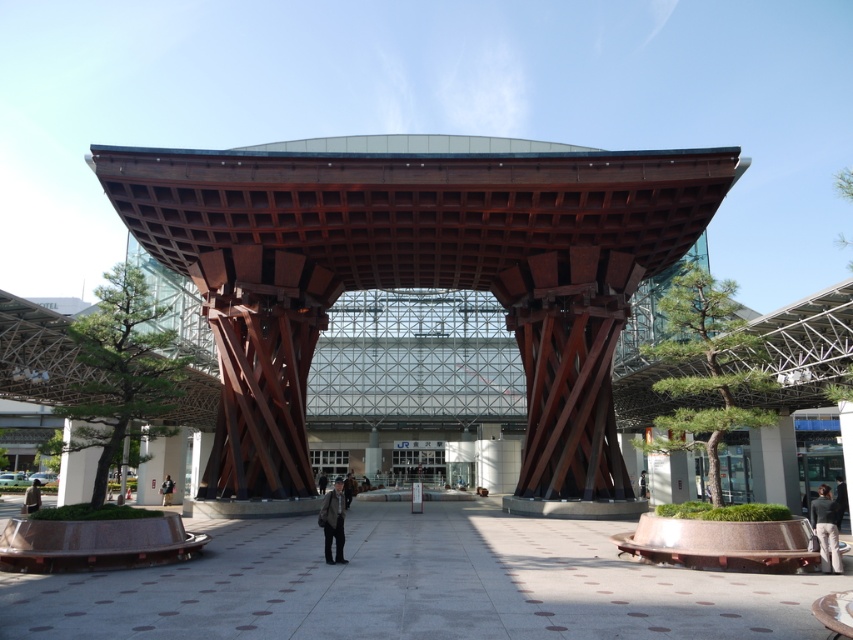
Question: Which object is positioned closest to the dark brown leather jacket at center?

Choices:
 (A) dark gray fabric bag at center
 (B) wooden structure at center
 (C) light beige pants at lower right
 (D) light brown leather jacket at lower left

Answer: (C)

Question: Is light beige pants at lower right positioned in front of dark gray fabric bag at center?

Choices:
 (A) no
 (B) yes

Answer: (B)

Question: Observing the image, what is the correct spatial positioning of wooden structure at center in reference to dark gray fabric bag at center?

Choices:
 (A) above
 (B) below

Answer: (A)

Question: Is light beige pants at lower right above dark brown leather jacket at center?

Choices:
 (A) no
 (B) yes

Answer: (B)

Question: Which object is the closest to the light brown leather jacket at lower left?

Choices:
 (A) dark brown leather jacket at center
 (B) wooden structure at center
 (C) dark gray fabric bag at center
 (D) light beige pants at lower right

Answer: (C)

Question: Which of the following is the farthest from the observer?

Choices:
 (A) dark gray fabric bag at center
 (B) wooden structure at center
 (C) light beige pants at lower right
 (D) dark brown leather jacket at center

Answer: (A)